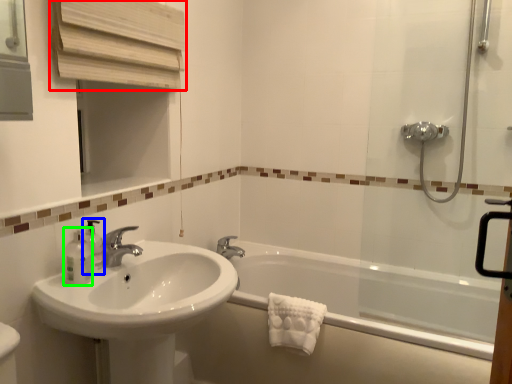
Question: Which object is the farthest from medicine cabinet (highlighted by a red box)? Choose among these: soap dispenser (highlighted by a blue box) or toiletry (highlighted by a green box).

Choices:
 (A) soap dispenser
 (B) toiletry

Answer: (B)